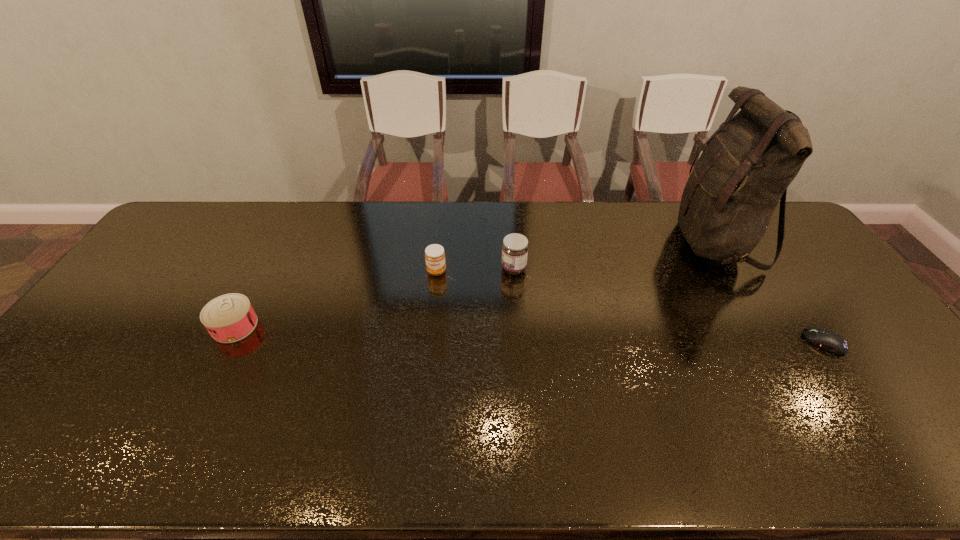
At what (x,y) coordinates should I click in order to perform the action: click on free spot located on the open flap of the backpack. Please return your answer as a coordinate pair (x, y). Image resolution: width=960 pixels, height=540 pixels. Looking at the image, I should click on point(641,241).

Image resolution: width=960 pixels, height=540 pixels. In order to click on free space located on the front label of the fourth shortest object in this screenshot , I will do (435, 268).

Identify the location of vacant point located 0.180m on the front label of the fourth shortest object. Image resolution: width=960 pixels, height=540 pixels. (444, 268).

Identify the location of free spot located 0.190m on the front label of the fourth shortest object. (442, 268).

The image size is (960, 540). Identify the location of free point located on the front label of the third shortest object. (434, 294).

Where is `vacant space located on the right of the leftmost object`? vacant space located on the right of the leftmost object is located at coordinates (364, 326).

This screenshot has height=540, width=960. Identify the location of blank space located 0.140m on the back of the computer equipment. (790, 293).

The height and width of the screenshot is (540, 960). In order to click on object situated at the far edge in this screenshot , I will do `click(745, 169)`.

This screenshot has width=960, height=540. What are the coordinates of `backpack situated at the right edge` in the screenshot? It's located at (745, 169).

Locate an element on the screen. The image size is (960, 540). computer equipment present at the right edge is located at coordinates (833, 342).